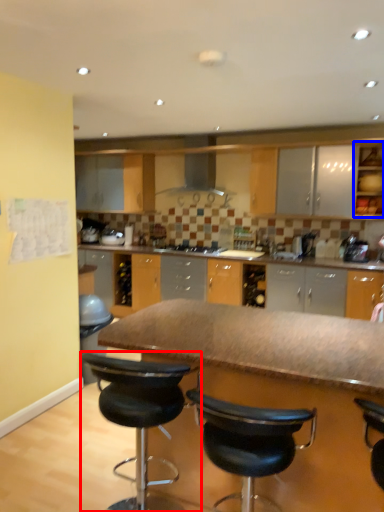
Question: Among these objects, which one is farthest to the camera, chair (highlighted by a red box) or cabinetry (highlighted by a blue box)?

Choices:
 (A) chair
 (B) cabinetry

Answer: (B)